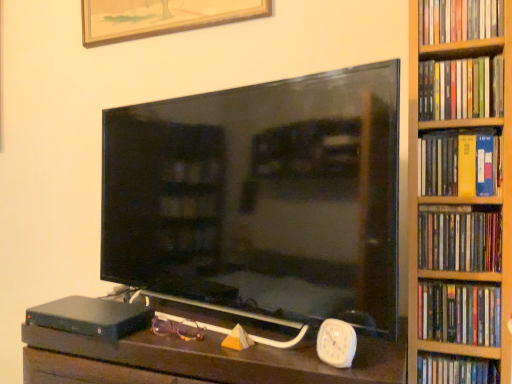
Question: Considering their positions, is black matte hardcover at lower left located in front of or behind purple plastic glasses at center?

Choices:
 (A) front
 (B) behind

Answer: (A)

Question: Is point (114, 299) closer or farther from the camera than point (159, 314)?

Choices:
 (A) farther
 (B) closer

Answer: (A)

Question: Estimate the real-world distances between objects in this image. Which object is closer to the white plastic clock at lower right?

Choices:
 (A) black matte hardcover at lower left
 (B) hardcover book at right, placed as the 3th book when sorted from bottom to top
 (C) hardcover book at right, which is the 6th book in top-to-bottom order
 (D) yellow matte book at right, the 3th book in the top-to-bottom sequence
 (E) hardcover book at right, the 5th book positioned from the bottom

Answer: (C)

Question: Based on their relative distances, which object is nearer to the hardcover book at right, the fourth book from the top?

Choices:
 (A) purple plastic glasses at center
 (B) hardcover book at right, which is the 5th book in top-to-bottom order
 (C) black matte hardcover at lower left
 (D) hardcover book at right, arranged as the 1th book when viewed from the top
 (E) yellow matte book at right, the 3th book in the top-to-bottom sequence

Answer: (B)